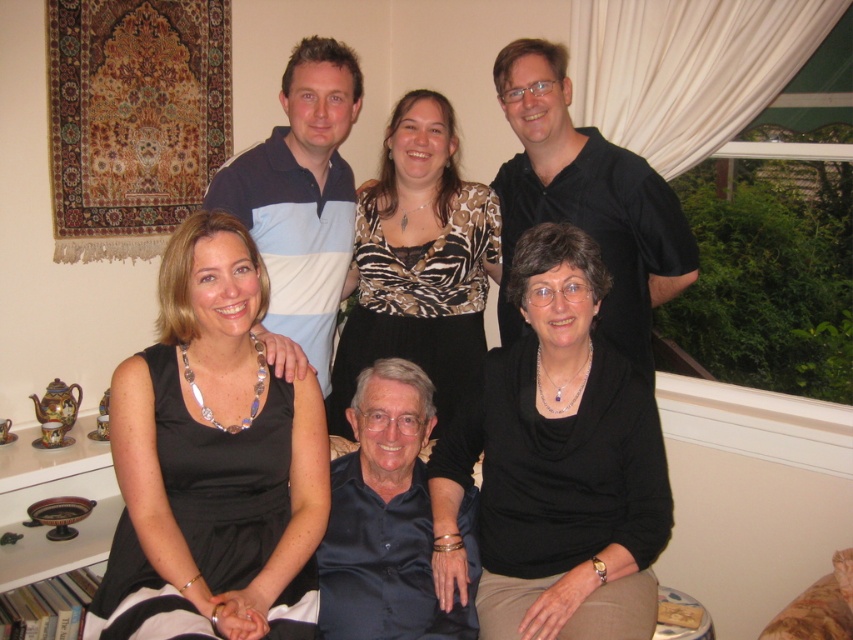
Question: Which object appears farthest from the camera in this image?

Choices:
 (A) black silk dress at upper center
 (B) black matte sweater at lower center

Answer: (A)

Question: Which of the following is the closest to the observer?

Choices:
 (A) (561, 401)
 (B) (454, 323)
 (C) (573, 563)
 (D) (178, 428)

Answer: (D)

Question: Is black satin dress at center wider than black matte sweater at lower center?

Choices:
 (A) yes
 (B) no

Answer: (B)

Question: In this image, where is black satin dress at center located relative to black matte sweater at lower center?

Choices:
 (A) below
 (B) above

Answer: (B)

Question: Which object is closer to the camera taking this photo?

Choices:
 (A) black satin dress at center
 (B) black matte sweater at lower center

Answer: (A)

Question: Is black satin dress at center positioned at the back of zebra print blouse at center?

Choices:
 (A) no
 (B) yes

Answer: (A)